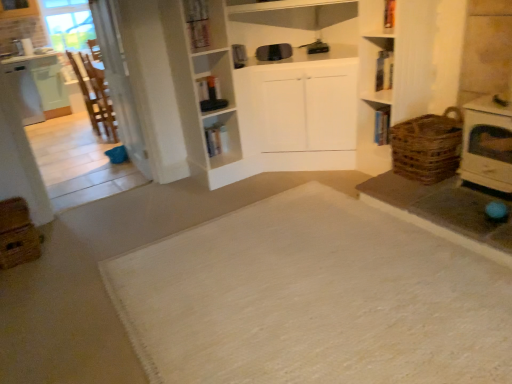
Question: From the image's perspective, is brown woven basket at right located beneath brown woven crate at lower left?

Choices:
 (A) no
 (B) yes

Answer: (A)

Question: From a real-world perspective, is brown woven basket at right positioned under brown woven crate at lower left based on gravity?

Choices:
 (A) no
 (B) yes

Answer: (A)

Question: Considering the relative sizes of brown woven basket at right and brown woven crate at lower left in the image provided, is brown woven basket at right wider than brown woven crate at lower left?

Choices:
 (A) yes
 (B) no

Answer: (A)

Question: Can you confirm if brown woven basket at right is shorter than brown woven crate at lower left?

Choices:
 (A) no
 (B) yes

Answer: (A)

Question: From a real-world perspective, is brown woven basket at right positioned over brown woven crate at lower left based on gravity?

Choices:
 (A) no
 (B) yes

Answer: (B)

Question: Is wooden chair at left inside the boundaries of white woven mat at center, or outside?

Choices:
 (A) outside
 (B) inside

Answer: (A)

Question: Is wooden chair at left bigger or smaller than white woven mat at center?

Choices:
 (A) small
 (B) big

Answer: (A)

Question: Visually, is wooden chair at left positioned to the left or to the right of white woven mat at center?

Choices:
 (A) left
 (B) right

Answer: (A)

Question: In terms of height, does wooden chair at left look taller or shorter compared to white woven mat at center?

Choices:
 (A) short
 (B) tall

Answer: (B)

Question: In the image, is brown woven basket at right on the left side or the right side of brown woven crate at lower left?

Choices:
 (A) left
 (B) right

Answer: (B)

Question: From a real-world perspective, is brown woven basket at right physically located above or below brown woven crate at lower left?

Choices:
 (A) above
 (B) below

Answer: (A)

Question: In terms of size, does brown woven basket at right appear bigger or smaller than brown woven crate at lower left?

Choices:
 (A) small
 (B) big

Answer: (B)

Question: Is brown woven basket at right in front of or behind brown woven crate at lower left in the image?

Choices:
 (A) front
 (B) behind

Answer: (B)

Question: From a real-world perspective, is white woven mat at center physically located above or below brown woven basket at right?

Choices:
 (A) above
 (B) below

Answer: (B)

Question: In terms of height, does white woven mat at center look taller or shorter compared to brown woven basket at right?

Choices:
 (A) tall
 (B) short

Answer: (B)